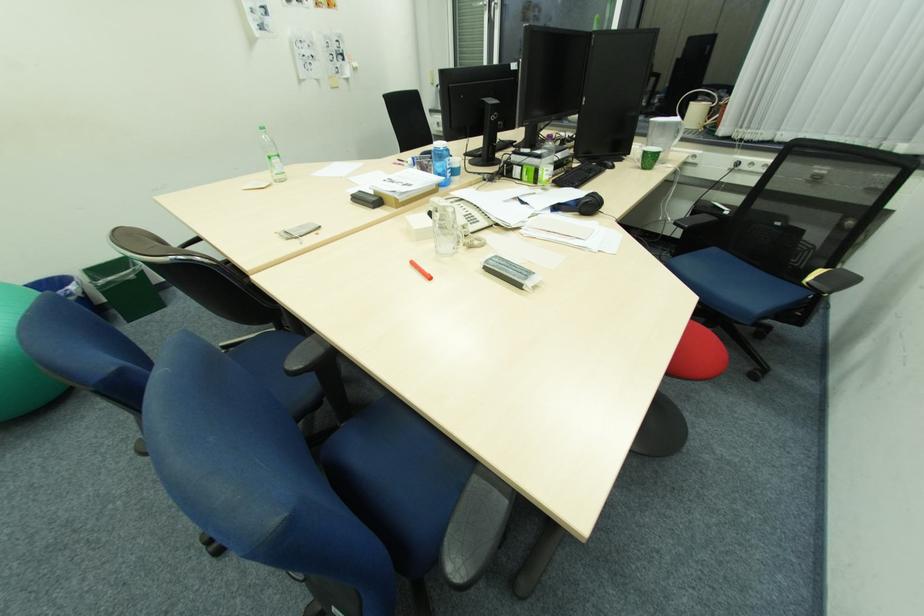
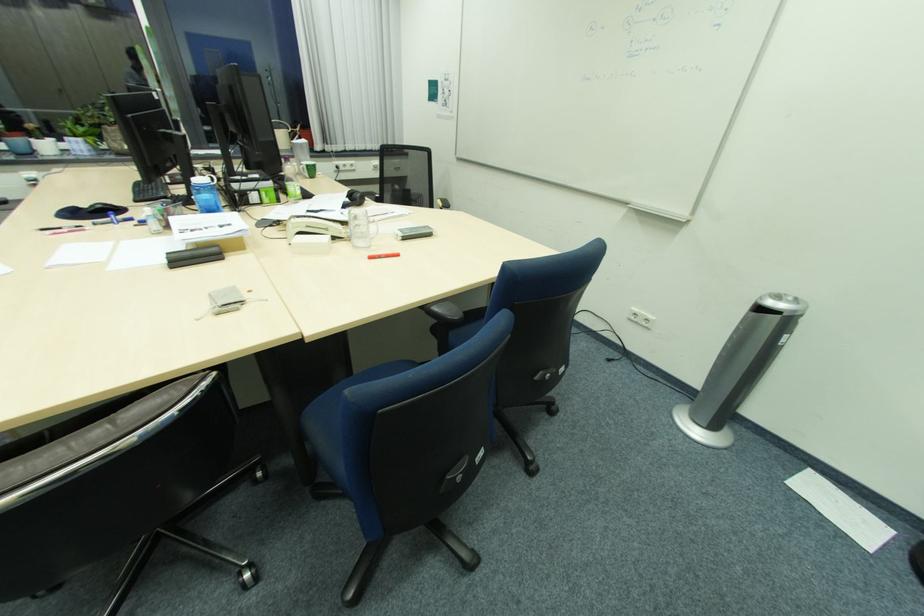
Question: I am providing you with two images of the same scene from different viewpoints. After the viewpoint changes to image2, which objects are now occluded?

Choices:
 (A) blue water bottle
 (B) orange marker
 (C) chair armrest
 (D) green-capped shaker

Answer: (C)